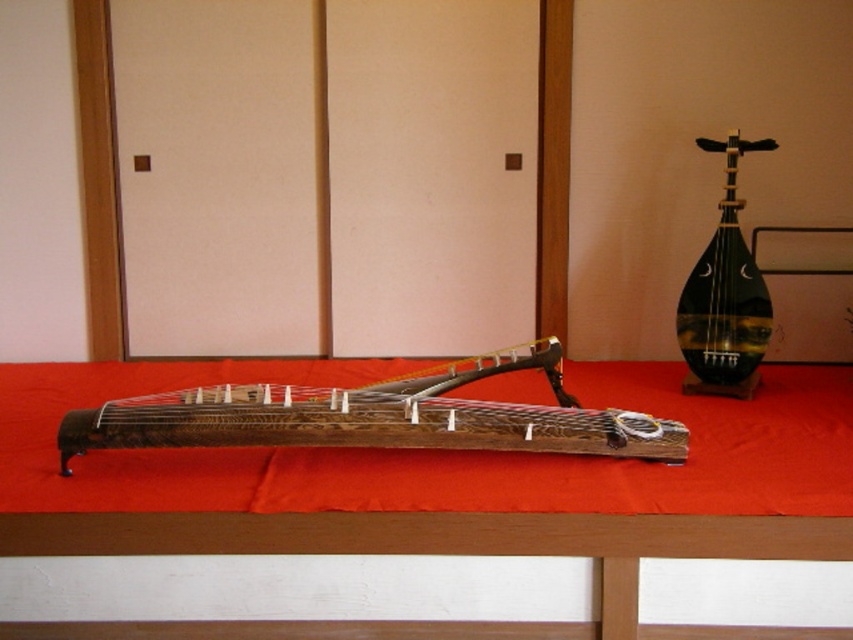
The width and height of the screenshot is (853, 640). What do you see at coordinates (378, 417) in the screenshot? I see `wooden stringed instrument at center` at bounding box center [378, 417].

This screenshot has width=853, height=640. I want to click on wooden stringed instrument at center, so click(378, 417).

Where is `wooden stringed instrument at center`? The width and height of the screenshot is (853, 640). wooden stringed instrument at center is located at coordinates (378, 417).